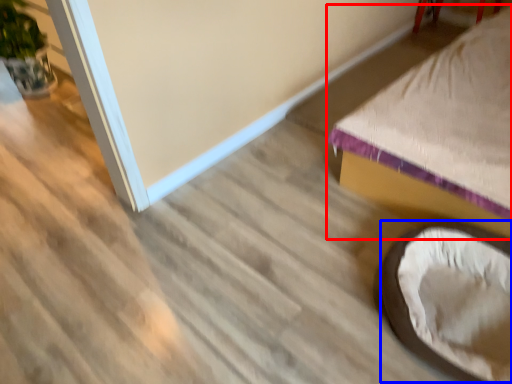
Question: Which object appears farthest to the camera in this image, furniture (highlighted by a red box) or bean bag chair (highlighted by a blue box)?

Choices:
 (A) furniture
 (B) bean bag chair

Answer: (B)